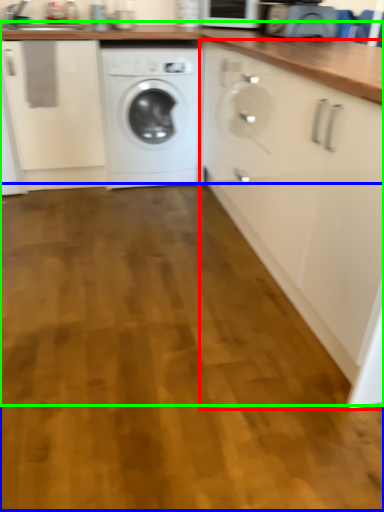
Question: Which object is positioned closest to cabinetry (highlighted by a red box)? Select from plain (highlighted by a blue box) and counter (highlighted by a green box).

Choices:
 (A) plain
 (B) counter

Answer: (B)